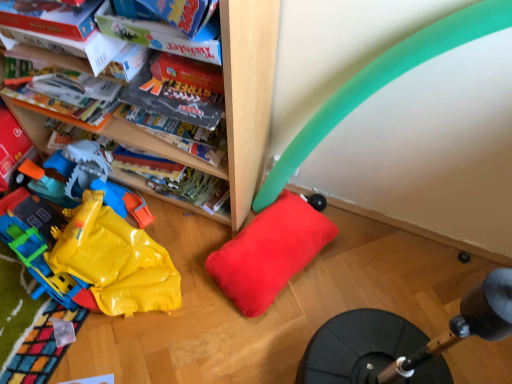
Question: Is yellow plastic bag at lower left bigger than soft red pillow at center?

Choices:
 (A) no
 (B) yes

Answer: (B)

Question: Considering the relative sizes of yellow plastic bag at lower left and soft red pillow at center in the image provided, is yellow plastic bag at lower left wider than soft red pillow at center?

Choices:
 (A) no
 (B) yes

Answer: (B)

Question: From a real-world perspective, is yellow plastic bag at lower left located beneath soft red pillow at center?

Choices:
 (A) yes
 (B) no

Answer: (B)

Question: Is yellow plastic bag at lower left not close to soft red pillow at center?

Choices:
 (A) yes
 (B) no

Answer: (B)

Question: From the image's perspective, is yellow plastic bag at lower left beneath soft red pillow at center?

Choices:
 (A) no
 (B) yes

Answer: (A)

Question: In terms of width, does yellow plastic bag at lower left look wider or thinner when compared to matte cardboard book at upper left?

Choices:
 (A) wide
 (B) thin

Answer: (A)

Question: From a real-world perspective, is yellow plastic bag at lower left positioned above or below matte cardboard book at upper left?

Choices:
 (A) above
 (B) below

Answer: (B)

Question: In the image, is yellow plastic bag at lower left positioned in front of or behind matte cardboard book at upper left?

Choices:
 (A) behind
 (B) front

Answer: (A)

Question: Is point (74, 215) positioned closer to the camera than point (61, 18)?

Choices:
 (A) farther
 (B) closer

Answer: (A)

Question: Considering the positions of soft red pillow at center and matte cardboard book at upper left in the image, is soft red pillow at center bigger or smaller than matte cardboard book at upper left?

Choices:
 (A) small
 (B) big

Answer: (B)

Question: Is point (267, 208) positioned closer to the camera than point (0, 19)?

Choices:
 (A) closer
 (B) farther

Answer: (B)

Question: Considering their positions, is soft red pillow at center located in front of or behind matte cardboard book at upper left?

Choices:
 (A) front
 (B) behind

Answer: (B)

Question: Considering the positions of soft red pillow at center and matte cardboard book at upper left in the image, is soft red pillow at center wider or thinner than matte cardboard book at upper left?

Choices:
 (A) thin
 (B) wide

Answer: (B)

Question: Is point pyautogui.click(x=41, y=19) positioned closer to the camera than point pyautogui.click(x=267, y=289)?

Choices:
 (A) closer
 (B) farther

Answer: (A)

Question: From their relative heights in the image, would you say matte cardboard book at upper left is taller or shorter than soft red pillow at center?

Choices:
 (A) tall
 (B) short

Answer: (B)